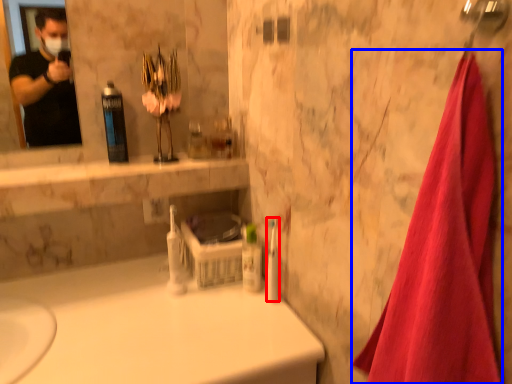
Question: Among these objects, which one is farthest to the camera, toiletry (highlighted by a red box) or bath towel (highlighted by a blue box)?

Choices:
 (A) toiletry
 (B) bath towel

Answer: (A)